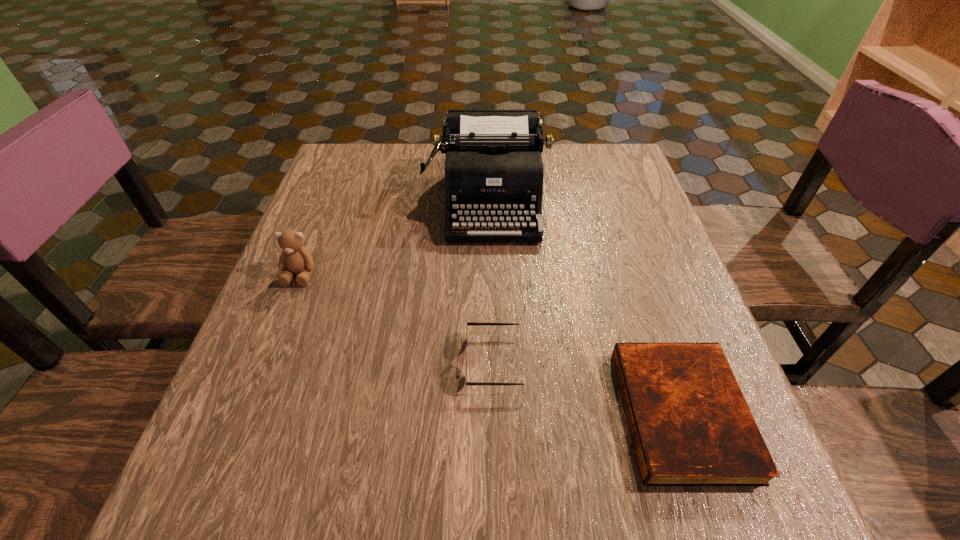
Where is `free spot between the rightmost object and the third tallest object`? free spot between the rightmost object and the third tallest object is located at coordinates (588, 387).

At what (x,y) coordinates should I click in order to perform the action: click on vacant area that lies between the shortest object and the second tallest object. Please return your answer as a coordinate pair (x, y). The width and height of the screenshot is (960, 540). Looking at the image, I should click on (491, 344).

Where is `free space between the shortest object and the typewriter`? This screenshot has height=540, width=960. free space between the shortest object and the typewriter is located at coordinates (585, 307).

You are a GUI agent. You are given a task and a screenshot of the screen. Output one action in this format:
    pyautogui.click(x=<x>, y=<y>)
    Task: Click on the unoccupied position between the sunglasses and the leftmost object
    The width and height of the screenshot is (960, 540).
    Given the screenshot: What is the action you would take?
    pyautogui.click(x=396, y=318)

Find the location of a particular element. free point between the Bible and the second shortest object is located at coordinates (588, 387).

What are the coordinates of `free space between the second shortest object and the leftmost object` in the screenshot? It's located at (396, 318).

Where is `empty space between the leftmost object and the typewriter`? empty space between the leftmost object and the typewriter is located at coordinates 395,238.

Locate which object ranks second in proximity to the third tallest object. Please provide its 2D coordinates. Your answer should be formatted as a tuple, i.e. [(x, y)], where the tuple contains the x and y coordinates of a point satisfying the conditions above.

[(494, 171)]

What are the coordinates of `object identified as the second closest to the sunglasses` in the screenshot? It's located at (494, 171).